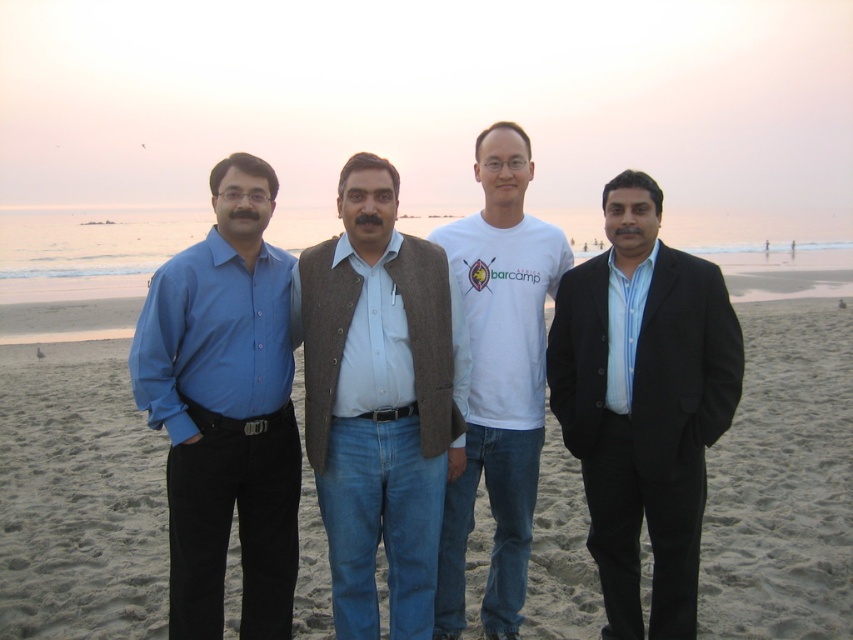
Is black matte suit at center positioned at the back of matte blue shirt at left?

Yes, black matte suit at center is behind matte blue shirt at left.

Between black matte suit at center and matte blue shirt at left, which one has less height?

With less height is black matte suit at center.

Does point (608, 611) lie behind point (241, 442)?

That is True.

What are the coordinates of `black matte suit at center` in the screenshot? It's located at (643, 403).

The width and height of the screenshot is (853, 640). Identify the location of sandy beach at center. (78, 499).

Which is behind, point (815, 493) or point (479, 296)?

The point (815, 493) is more distant.

You are a GUI agent. You are given a task and a screenshot of the screen. Output one action in this format:
    pyautogui.click(x=<x>, y=<y>)
    Task: Click on the sandy beach at center
    
    Given the screenshot: What is the action you would take?
    pyautogui.click(x=78, y=499)

Is matte blue shirt at left to the left of white cotton t-shirt at center from the viewer's perspective?

Correct, you'll find matte blue shirt at left to the left of white cotton t-shirt at center.

Which of these two, matte blue shirt at left or white cotton t-shirt at center, stands taller?

matte blue shirt at left

Does point (171, 532) come in front of point (498, 448)?

Yes, point (171, 532) is in front of point (498, 448).

You are a GUI agent. You are given a task and a screenshot of the screen. Output one action in this format:
    pyautogui.click(x=<x>, y=<y>)
    Task: Click on the matte blue shirt at left
    The image size is (853, 640).
    Given the screenshot: What is the action you would take?
    pyautogui.click(x=225, y=410)